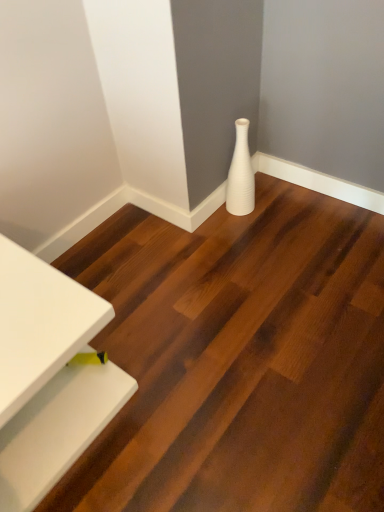
Question: From a real-world perspective, is white glossy table at lower left physically located above or below white ribbed vase at lower right?

Choices:
 (A) below
 (B) above

Answer: (B)

Question: Considering the positions of point (92, 437) and point (246, 150), is point (92, 437) closer or farther from the camera than point (246, 150)?

Choices:
 (A) closer
 (B) farther

Answer: (A)

Question: Which object is the farthest from the white glossy table at lower left?

Choices:
 (A) white ribbed vase at lower right
 (B) white glossy vase at center

Answer: (A)

Question: Estimate the real-world distances between objects in this image. Which object is farther from the white glossy vase at center?

Choices:
 (A) white glossy table at lower left
 (B) white ribbed vase at lower right

Answer: (B)